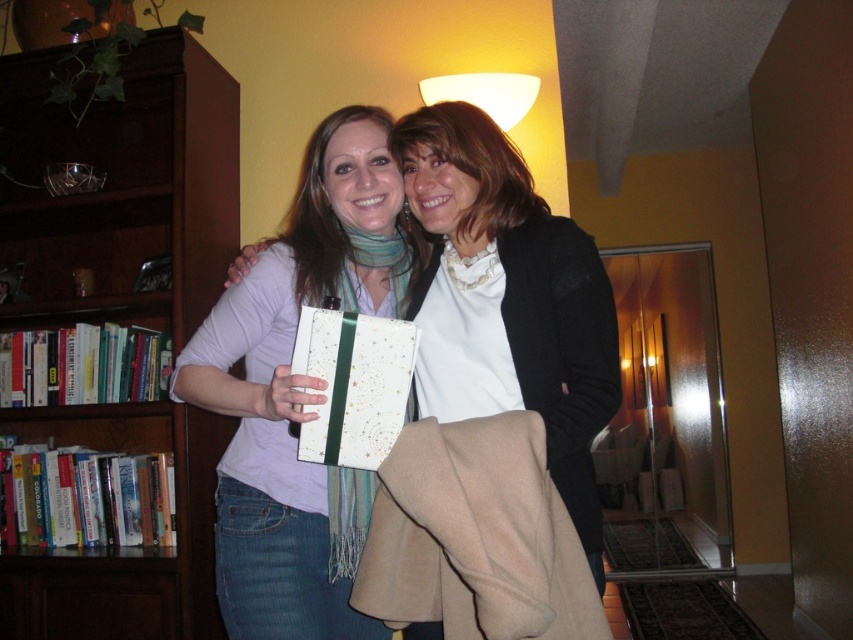
Question: Among these points, which one is farthest from the camera?

Choices:
 (A) (352, 282)
 (B) (363, 243)
 (C) (457, 74)

Answer: (C)

Question: Does matte white scarf at center have a greater width compared to white matte lampshade at upper center?

Choices:
 (A) no
 (B) yes

Answer: (B)

Question: Which object is positioned farthest from the matte white scarf at center?

Choices:
 (A) brown wood bookcase at left
 (B) matte black jacket at center

Answer: (A)

Question: Can you confirm if brown wood bookcase at left is smaller than multicolored woven scarf at center?

Choices:
 (A) yes
 (B) no

Answer: (B)

Question: Among these points, which one is nearest to the camera?

Choices:
 (A) (355, 298)
 (B) (403, 298)

Answer: (A)

Question: Is multicolored woven scarf at center behind white matte lampshade at upper center?

Choices:
 (A) no
 (B) yes

Answer: (A)